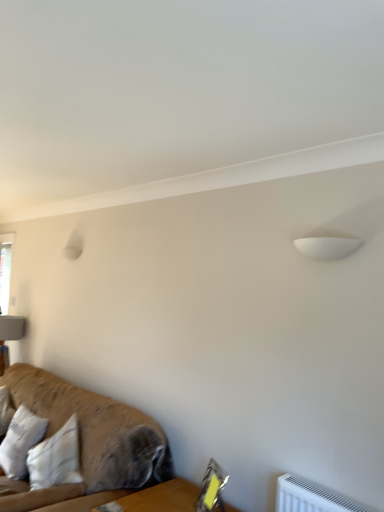
What is the approximate width of textured brown fabric couch at lower left?

14.58 inches.

This screenshot has height=512, width=384. What do you see at coordinates (96, 430) in the screenshot?
I see `textured brown fabric couch at lower left` at bounding box center [96, 430].

This screenshot has height=512, width=384. I want to click on textured brown fabric couch at lower left, so click(x=96, y=430).

This screenshot has height=512, width=384. What do you see at coordinates (20, 441) in the screenshot?
I see `white cotton pillow at lower left` at bounding box center [20, 441].

What are the coordinates of `white cotton pillow at lower left` in the screenshot? It's located at (20, 441).

What is the approximate width of white cotton pillow at lower left?

It is 9.31 inches.

The image size is (384, 512). Find the location of `textured brown fabric couch at lower left`. textured brown fabric couch at lower left is located at coordinates (96, 430).

Is textured brown fabric couch at lower left at the left side of white cotton pillow at lower left?

In fact, textured brown fabric couch at lower left is to the right of white cotton pillow at lower left.

Which is behind, textured brown fabric couch at lower left or white cotton pillow at lower left?

white cotton pillow at lower left is further from the camera.

Which is closer to the camera, (110, 469) or (21, 440)?

Point (110, 469).

From the image's perspective, is textured brown fabric couch at lower left positioned above or below white cotton pillow at lower left?

From the image's perspective, textured brown fabric couch at lower left appears above white cotton pillow at lower left.

From a real-world perspective, which object rests below the other?

white cotton pillow at lower left, from a real-world perspective.

Between textured brown fabric couch at lower left and white cotton pillow at lower left, which one has smaller width?

Thinner between the two is white cotton pillow at lower left.

Who is taller, textured brown fabric couch at lower left or white cotton pillow at lower left?

textured brown fabric couch at lower left is taller.

Considering the sizes of textured brown fabric couch at lower left and white cotton pillow at lower left in the image, is textured brown fabric couch at lower left bigger or smaller than white cotton pillow at lower left?

Considering their sizes, textured brown fabric couch at lower left takes up more space than white cotton pillow at lower left.

Would you say textured brown fabric couch at lower left is outside white cotton pillow at lower left?

Indeed, textured brown fabric couch at lower left is completely outside white cotton pillow at lower left.

Is textured brown fabric couch at lower left next to white cotton pillow at lower left and touching it?

No, textured brown fabric couch at lower left is not next to white cotton pillow at lower left.

Is textured brown fabric couch at lower left turned away from white cotton pillow at lower left?

That's right, textured brown fabric couch at lower left is facing away from white cotton pillow at lower left.

The image size is (384, 512). Identify the location of pillow behind the textured brown fabric couch at lower left. (20, 441).

Based on their positions, is white cotton pillow at lower left located to the left or right of textured brown fabric couch at lower left?

white cotton pillow at lower left is positioned on textured brown fabric couch at lower left's left side.

Is white cotton pillow at lower left in front of or behind textured brown fabric couch at lower left in the image?

white cotton pillow at lower left is positioned farther from the viewer than textured brown fabric couch at lower left.

Which is farther, (x=22, y=425) or (x=103, y=450)?

Positioned behind is point (x=22, y=425).

From the image's perspective, is white cotton pillow at lower left above or below textured brown fabric couch at lower left?

Based on their image positions, white cotton pillow at lower left is located beneath textured brown fabric couch at lower left.

Looking at this image, from a real-world perspective, between white cotton pillow at lower left and textured brown fabric couch at lower left, who is vertically lower?

white cotton pillow at lower left, from a real-world perspective.

Is white cotton pillow at lower left wider than textured brown fabric couch at lower left?

In fact, white cotton pillow at lower left might be narrower than textured brown fabric couch at lower left.

Based on the photo, is white cotton pillow at lower left taller than textured brown fabric couch at lower left?

No.

Can you confirm if white cotton pillow at lower left is smaller than textured brown fabric couch at lower left?

Yes, white cotton pillow at lower left is smaller than textured brown fabric couch at lower left.

Is white cotton pillow at lower left inside or outside of textured brown fabric couch at lower left?

white cotton pillow at lower left is not inside textured brown fabric couch at lower left, it's outside.

Is white cotton pillow at lower left with textured brown fabric couch at lower left?

white cotton pillow at lower left and textured brown fabric couch at lower left are not in contact.

Is white cotton pillow at lower left oriented towards textured brown fabric couch at lower left?

No, white cotton pillow at lower left does not turn towards textured brown fabric couch at lower left.

How different are the orientations of white cotton pillow at lower left and textured brown fabric couch at lower left in degrees?

The angular difference between white cotton pillow at lower left and textured brown fabric couch at lower left is 4.47 degrees.

What are the coordinates of `pillow below the textured brown fabric couch at lower left (from the image's perspective)` in the screenshot? It's located at (20, 441).

Locate an element on the screen. studio couch above the white cotton pillow at lower left (from a real-world perspective) is located at coordinates click(96, 430).

In order to click on studio couch on the right of the white cotton pillow at lower left in this screenshot , I will do `click(96, 430)`.